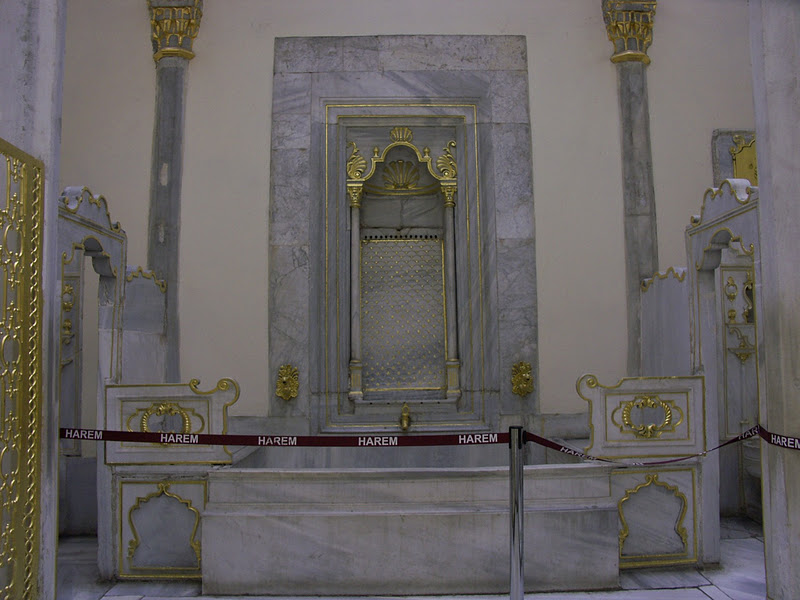
Where is `marble and gold archway`? marble and gold archway is located at coordinates (70, 246).